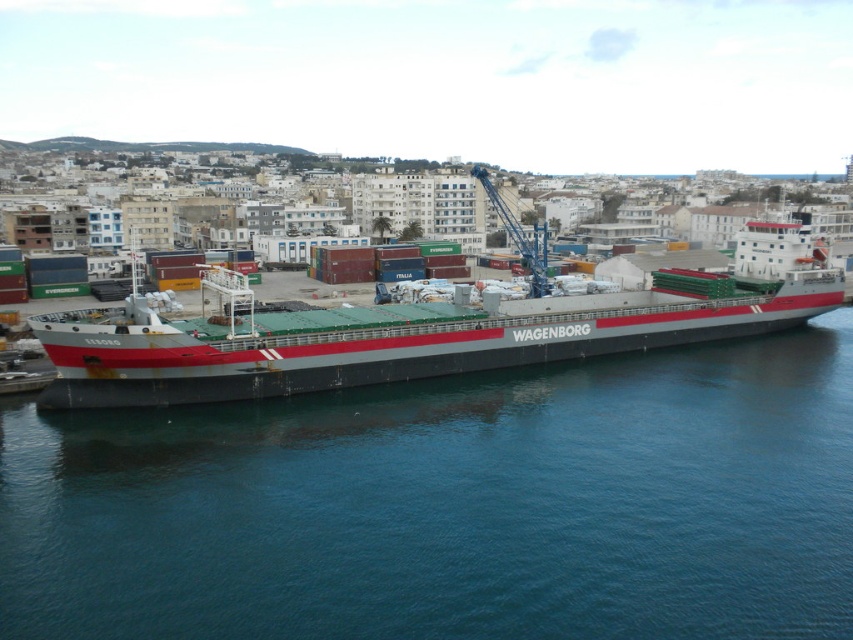
You are a port authority official checking the safety distance between the smooth dark blue water at center and the gray matte cargo ship at center. According to regulations, the minimum safe distance between a ship and the water surface is 15 meters. Is the current distance compliant with the safety regulations?

The smooth dark blue water at center is 14.62 meters away from the gray matte cargo ship at center, which is below the required 15 meters. Therefore, the current distance does not comply with the safety regulations.

From the picture: You are a photographer trying to capture the gray matte cargo ship at center in the image. Since you want the ship to be the main focus, will the smooth dark blue water at center take up more or less space in the photo compared to the ship?

The smooth dark blue water at center occupies less space than the gray matte cargo ship at center, so the water will take up less space than the ship in the photo.

You are standing on the deck of the cargo ship and want to find the smooth dark blue water at center. According to the coordinates provided, where should you look relative to your position?

The smooth dark blue water at center is located at point coordinates (451, 504), so you should look towards the center area of the ship where the coordinates point to find it.